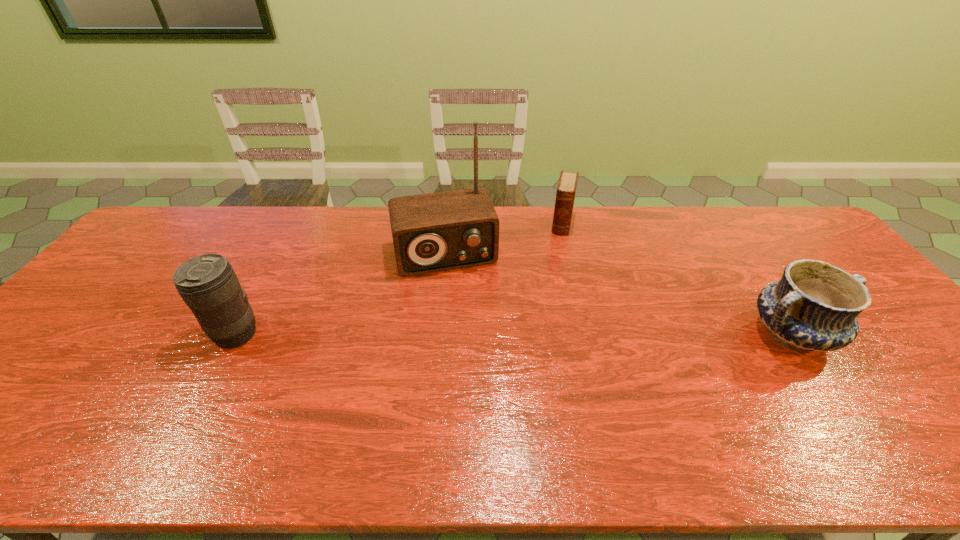
Identify the location of vacant spot on the desktop that is between the third shortest object and the pottery and is positioned on the front-facing side of the tallest object. (467, 334).

The height and width of the screenshot is (540, 960). Find the location of `free spot on the desktop that is between the telephoto lens and the pottery and is positioned on the spine side of the second object from right to left`. free spot on the desktop that is between the telephoto lens and the pottery and is positioned on the spine side of the second object from right to left is located at coordinates (540, 334).